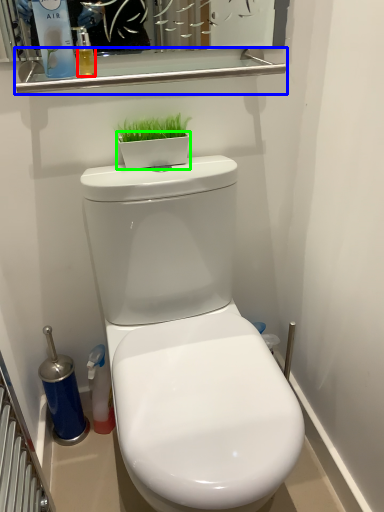
Question: Estimate the real-world distances between objects in this image. Which object is farther from liquid (highlighted by a red box), balustrade (highlighted by a blue box) or flowerpot (highlighted by a green box)?

Choices:
 (A) balustrade
 (B) flowerpot

Answer: (B)